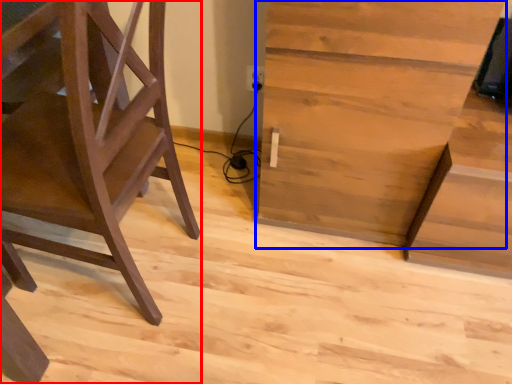
Question: Which of the following is the farthest to the observer, furniture (highlighted by a red box) or table (highlighted by a blue box)?

Choices:
 (A) furniture
 (B) table

Answer: (B)